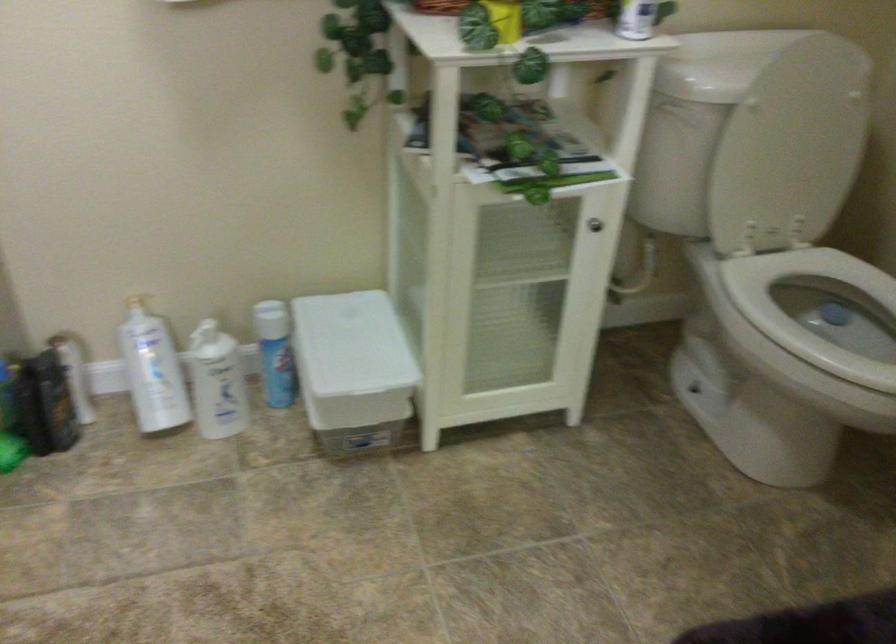
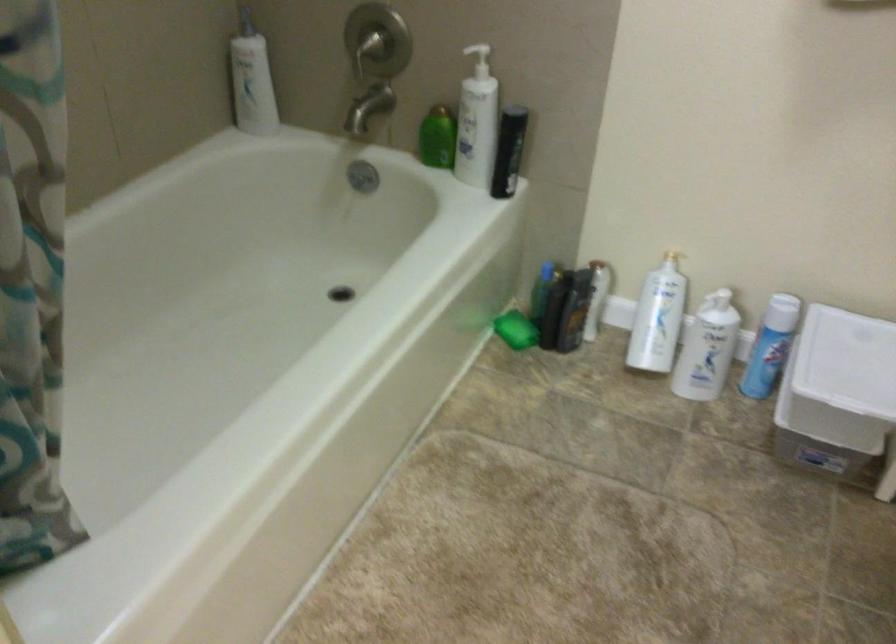
Find the pixel in the second image that matches point 138,294 in the first image.

(672, 249)